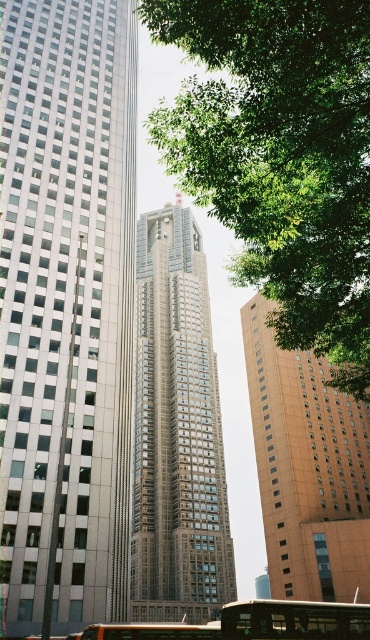
Question: Based on their relative distances, which object is nearer to the orange brick building at center?

Choices:
 (A) silver metallic skyscraper at left
 (B) metallic silver bus at center
 (C) green leafy tree at upper center
 (D) brown wooden tour bus at center

Answer: (C)

Question: Does green leafy tree at upper center appear on the left side of orange brick building at center?

Choices:
 (A) yes
 (B) no

Answer: (A)

Question: Which object appears farthest from the camera in this image?

Choices:
 (A) brown wooden tour bus at center
 (B) silver metallic skyscraper at left
 (C) orange brick building at center

Answer: (C)

Question: Is brown wooden tour bus at center bigger than metallic silver bus at center?

Choices:
 (A) no
 (B) yes

Answer: (A)

Question: Does green leafy tree at upper center appear under brown textured building at center?

Choices:
 (A) yes
 (B) no

Answer: (B)

Question: Which object is positioned farthest from the silver metallic skyscraper at left?

Choices:
 (A) brown wooden tour bus at center
 (B) metallic silver bus at center
 (C) green leafy tree at upper center

Answer: (A)